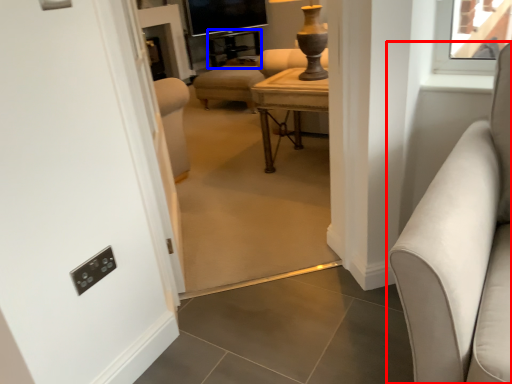
Question: Which of the following is the farthest to the observer, studio couch (highlighted by a red box) or side table (highlighted by a blue box)?

Choices:
 (A) studio couch
 (B) side table

Answer: (B)